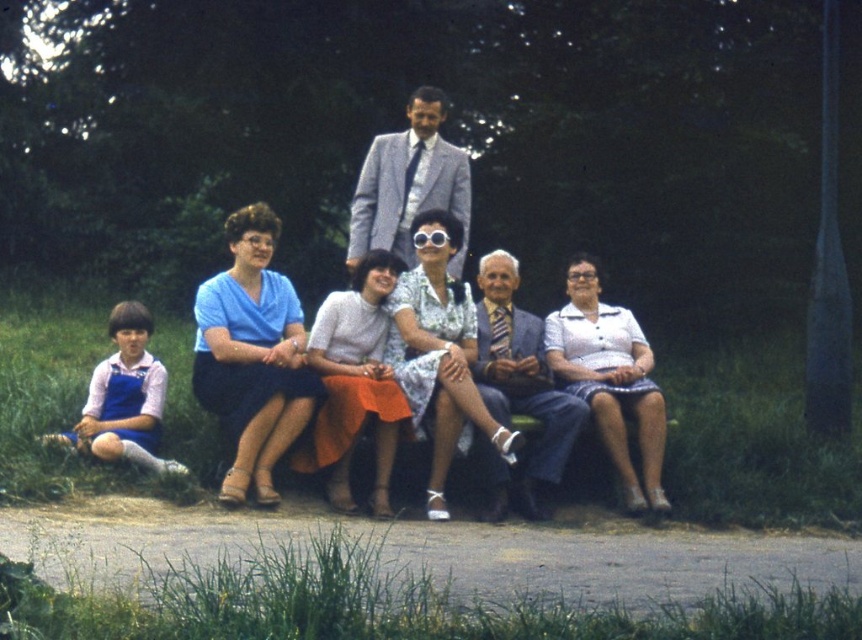
Question: Among these points, which one is nearest to the camera?

Choices:
 (A) (295, 294)
 (B) (458, 387)
 (C) (601, 362)

Answer: (B)

Question: Can you confirm if printed fabric dress at center is positioned below blue denim overalls at left?

Choices:
 (A) yes
 (B) no

Answer: (B)

Question: Which point is farther from the camera taking this photo?

Choices:
 (A) (392, 358)
 (B) (586, 362)
 (C) (236, 481)
 (D) (529, 358)

Answer: (B)

Question: Does printed fabric dress at center appear on the right side of light blue fabric suit at center?

Choices:
 (A) yes
 (B) no

Answer: (B)

Question: Does printed fabric dress at center have a smaller size compared to blue denim overalls at left?

Choices:
 (A) no
 (B) yes

Answer: (A)

Question: Among these objects, which one is nearest to the camera?

Choices:
 (A) white textured blouse at center
 (B) light blue fabric suit at center
 (C) matte blue dress at center
 (D) printed fabric dress at center

Answer: (D)